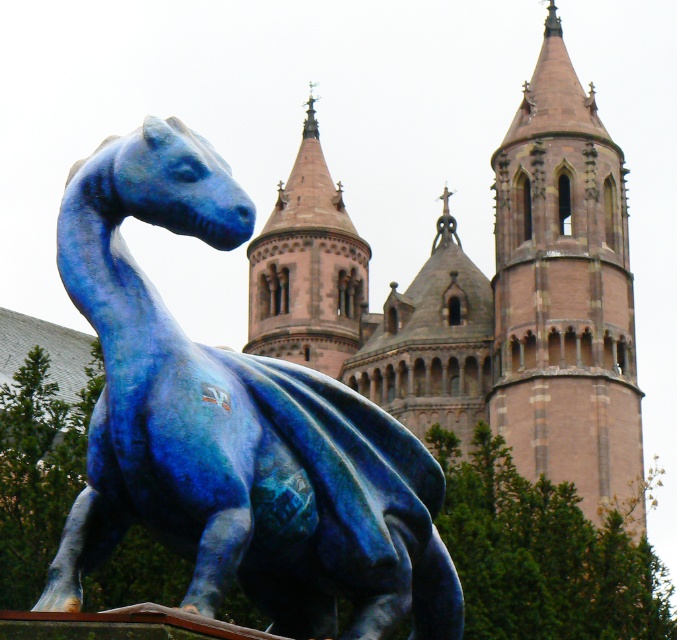
You are an architect visiting the sculpture garden and want to take a photo of both the blue glossy dragon at left and the brown stone tower at upper center in the same frame. Based on their sizes, which object should you focus on first to ensure both are visible in the photo?

The blue glossy dragon at left is smaller than the brown stone tower at upper center. To ensure both are visible in the photo, focus on the brown stone tower at upper center first since it is larger and will occupy more space in the frame, allowing the smaller dragon to fit alongside.

You are an architect examining the image of the dinosaur sculpture in front of the historic building. You notice two brown stone towers in the background. Which tower, the brown stone tower at upper center or the brown stone tower at center, has a greater height?

The brown stone tower at upper center is taller than the brown stone tower at center.